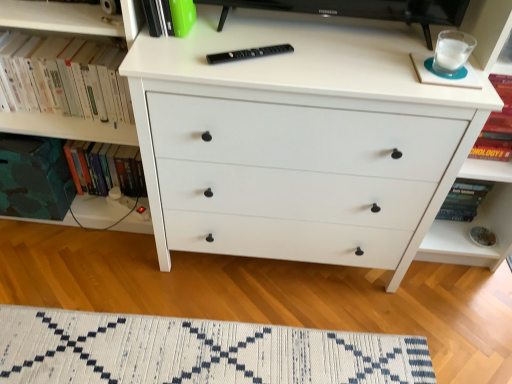
Question: Considering the relative positions of white woven mat at lower center and white matte chest of drawers at center in the image provided, is white woven mat at lower center in front of white matte chest of drawers at center?

Choices:
 (A) no
 (B) yes

Answer: (A)

Question: Is white woven mat at lower center facing towards white matte chest of drawers at center?

Choices:
 (A) no
 (B) yes

Answer: (B)

Question: Can you confirm if white woven mat at lower center is taller than white matte chest of drawers at center?

Choices:
 (A) yes
 (B) no

Answer: (B)

Question: From the image's perspective, would you say white woven mat at lower center is positioned over white matte chest of drawers at center?

Choices:
 (A) no
 (B) yes

Answer: (A)

Question: Can you confirm if white woven mat at lower center is smaller than white matte chest of drawers at center?

Choices:
 (A) yes
 (B) no

Answer: (A)

Question: From the image's perspective, relative to white matte chest of drawers at center, is green matte book at upper center, which is counted as the first book, starting from the front, above or below?

Choices:
 (A) above
 (B) below

Answer: (A)

Question: Is green matte book at upper center, which is counted as the third book, starting from the back, to the left or to the right of white matte chest of drawers at center in the image?

Choices:
 (A) left
 (B) right

Answer: (A)

Question: Considering the positions of green matte book at upper center, which is counted as the third book, starting from the back, and white matte chest of drawers at center in the image, is green matte book at upper center, which is counted as the third book, starting from the back, taller or shorter than white matte chest of drawers at center?

Choices:
 (A) tall
 (B) short

Answer: (B)

Question: From a real-world perspective, is green matte book at upper center, which is counted as the third book, starting from the back, above or below white matte chest of drawers at center?

Choices:
 (A) above
 (B) below

Answer: (A)

Question: Would you say white matte chest of drawers at center is to the left or to the right of green matte book at upper center, which is counted as the third book, starting from the back, in the picture?

Choices:
 (A) right
 (B) left

Answer: (A)

Question: Is point (285, 246) positioned closer to the camera than point (186, 6)?

Choices:
 (A) closer
 (B) farther

Answer: (B)

Question: Considering the positions of white matte chest of drawers at center and green matte book at upper center, which is counted as the first book, starting from the front, in the image, is white matte chest of drawers at center wider or thinner than green matte book at upper center, which is counted as the first book, starting from the front,?

Choices:
 (A) thin
 (B) wide

Answer: (B)

Question: Is white matte chest of drawers at center spatially inside green matte book at upper center, which is counted as the first book, starting from the front, or outside of it?

Choices:
 (A) inside
 (B) outside

Answer: (B)

Question: Is white matte chest of drawers at center wider or thinner than white paperbacks at left, the 2th book positioned from the back?

Choices:
 (A) wide
 (B) thin

Answer: (A)

Question: From the image's perspective, is white matte chest of drawers at center above or below white paperbacks at left, acting as the second book starting from the front?

Choices:
 (A) below
 (B) above

Answer: (A)